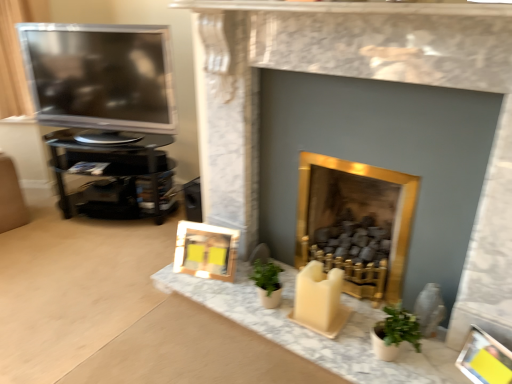
The width and height of the screenshot is (512, 384). Find the location of `free spot to the left of matte gray vase at lower right`. free spot to the left of matte gray vase at lower right is located at coordinates (365, 318).